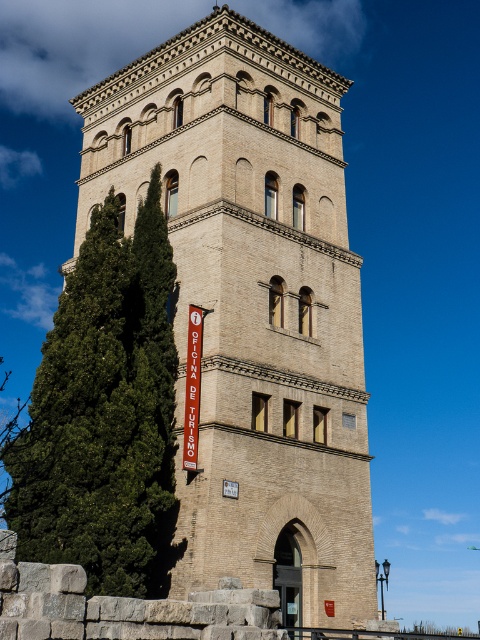
You are a tourist standing in front of the beige stone tower at center and the green leafy tree at left. Which object appears bigger in the image?

The beige stone tower at center appears bigger than the green leafy tree at left because it has a larger size compared to the tree.

Consider the image. You are standing in front of the tower and want to determine the relative positions of two points marked on its surface. The first point is at coordinate point (x=288, y=611) and the second is at point (x=75, y=513). Which point is closer to you?

Point (x=288, y=611) is further to the viewer than point (x=75, y=513), so the second point is closer to you.

You are a tourist standing in front of the beige stone tower at center and the green leafy tree at left. You want to take a photo that includes both objects in the frame. Which object should you position closer to the edge of the frame to ensure both fit?

Since the beige stone tower at center is wider than the green leafy tree at left, you should position the beige stone tower at center closer to the edge of the frame to make both objects fit within the photo.